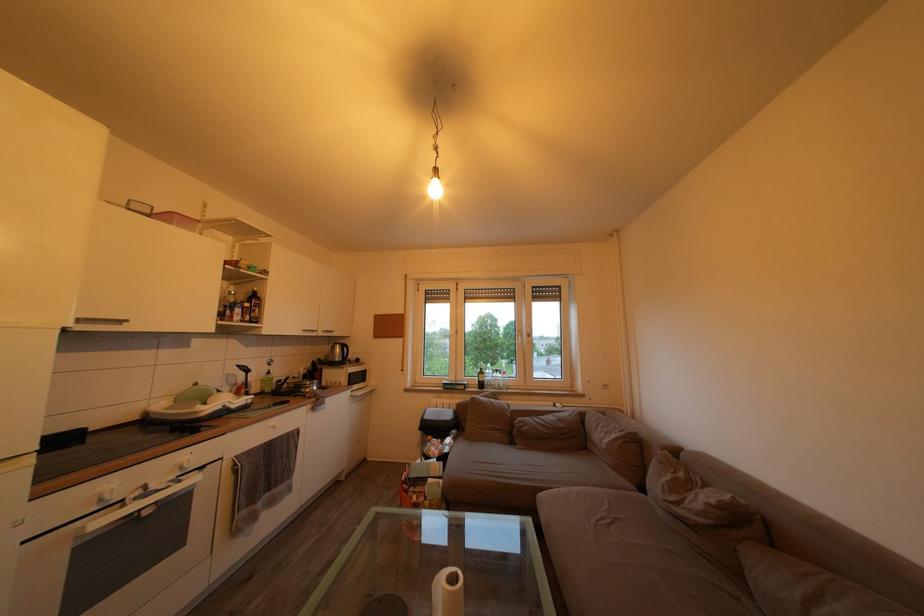
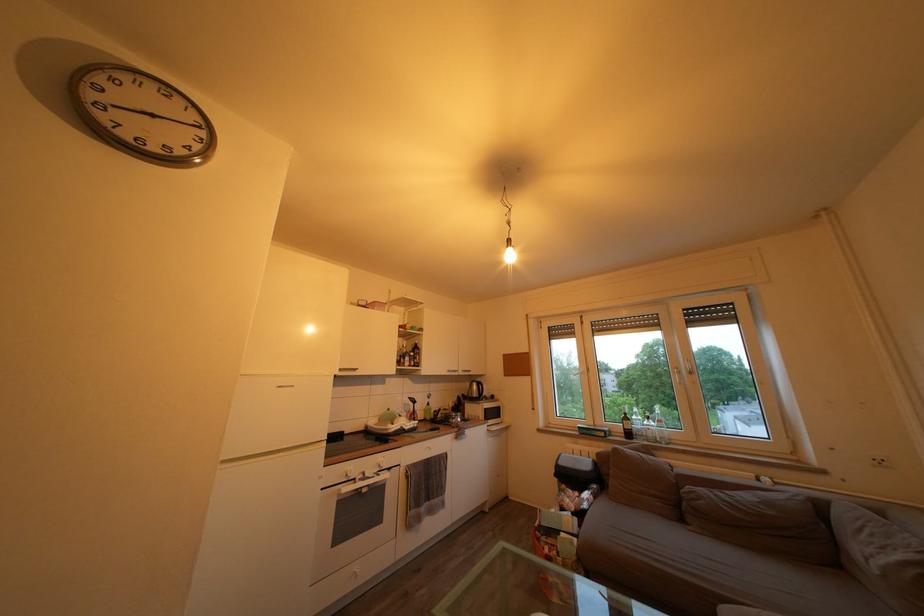
Find the pixel in the second image that matches (346,355) in the first image.

(482, 392)